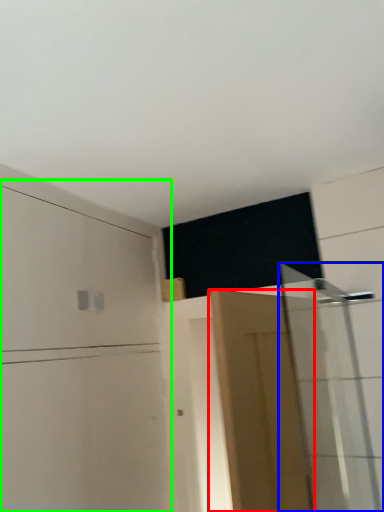
Question: Which object is the closest to the door (highlighted by a red box)? Choose among these: shower door (highlighted by a blue box) or dresser (highlighted by a green box).

Choices:
 (A) shower door
 (B) dresser

Answer: (A)